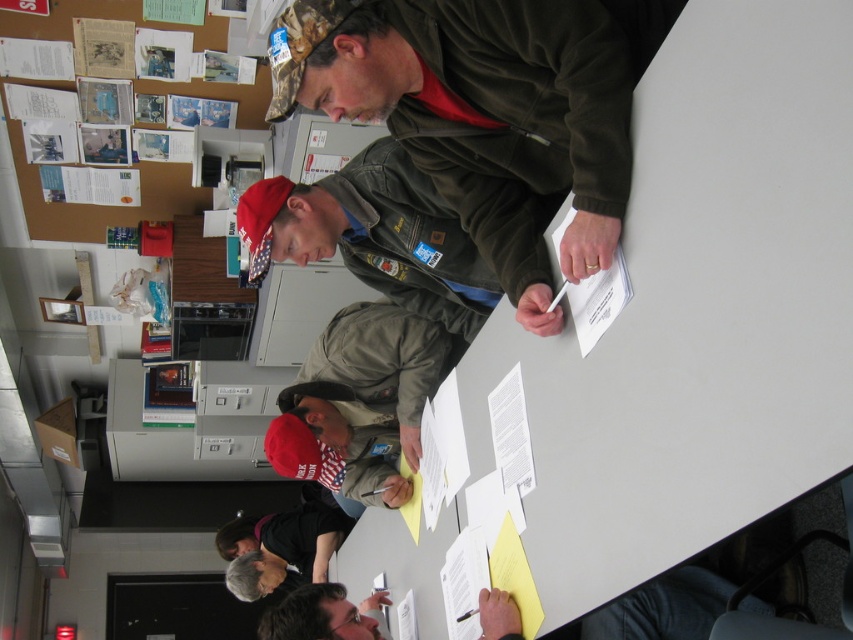
You are organizing a meeting in an office and need to place a large document organizer on the table. Considering the white matte table at center and the dark gray shirt at lower center, which object has a smaller width that might limit the space available for the organizer?

The white matte table at center has a lesser width compared to dark gray shirt at lower center, so the white matte table at center has a smaller width and might limit the space available for the organizer.

You are a delivery person who needs to place a 1.5 meter long package between the dark gray fabric shirt at lower center and the dark gray shirt at lower center. Can you fit the package between them?

The distance between the dark gray fabric shirt at lower center and the dark gray shirt at lower center is 1.85 meters, so yes, the 1.5 meter long package can fit between them since it is shorter than the available space.